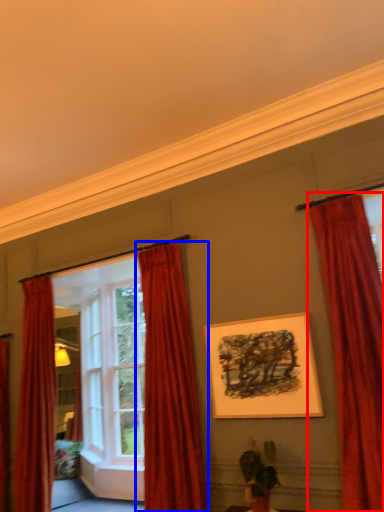
Question: Which of the following is the closest to the observer, curtain (highlighted by a red box) or curtain (highlighted by a blue box)?

Choices:
 (A) curtain
 (B) curtain

Answer: (A)